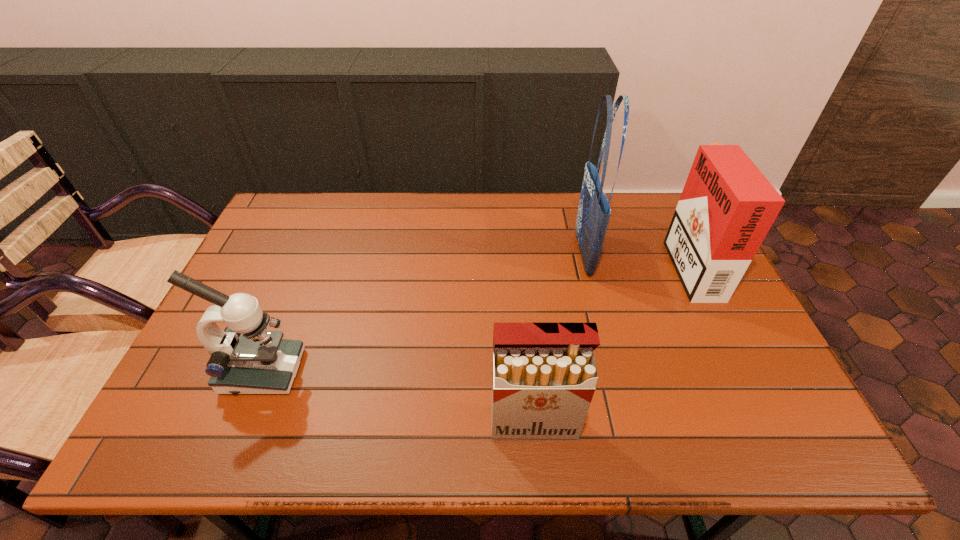
The width and height of the screenshot is (960, 540). I want to click on object that is positioned at the far right corner, so click(727, 206).

Identify the location of vacant space at the far edge. (338, 197).

Where is `free region at the near edge of the desktop`? The height and width of the screenshot is (540, 960). free region at the near edge of the desktop is located at coordinates (715, 444).

Locate an element on the screen. This screenshot has height=540, width=960. vacant space at the left edge of the desktop is located at coordinates (268, 247).

In the image, there is a desktop. Identify the location of vacant space at the right edge. (721, 364).

Find the location of a particular element. vacant region at the far left corner of the desktop is located at coordinates (308, 205).

You are a GUI agent. You are given a task and a screenshot of the screen. Output one action in this format:
    pyautogui.click(x=<x>, y=<y>)
    Task: Click on the free point at the near right corner
    This screenshot has width=960, height=540.
    Given the screenshot: What is the action you would take?
    pyautogui.click(x=796, y=441)

Locate an element on the screen. The image size is (960, 540). vacant area that lies between the right cigarette case and the microscope is located at coordinates (476, 318).

You are a GUI agent. You are given a task and a screenshot of the screen. Output one action in this format:
    pyautogui.click(x=<x>, y=<y>)
    Task: Click on the vacant area that lies between the third farthest object and the second object from right to left
    Image resolution: width=960 pixels, height=540 pixels.
    Given the screenshot: What is the action you would take?
    pyautogui.click(x=422, y=313)

This screenshot has width=960, height=540. I want to click on vacant space in between the right cigarette case and the tallest object, so click(x=636, y=259).